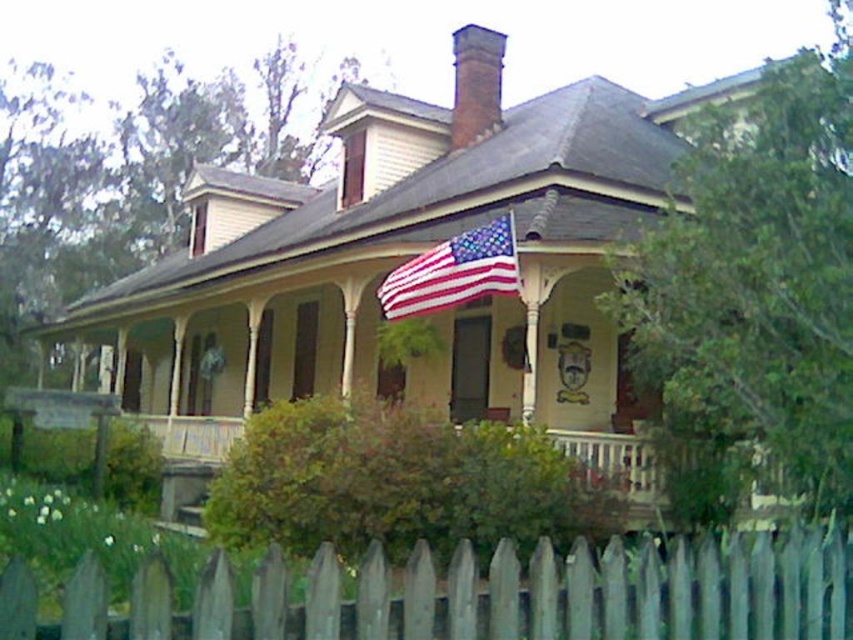
Question: Is gray wooden fence at lower center behind american flag at center?

Choices:
 (A) no
 (B) yes

Answer: (A)

Question: Does gray wooden fence at lower center appear over american flag at center?

Choices:
 (A) yes
 (B) no

Answer: (B)

Question: Which object appears closest to the camera in this image?

Choices:
 (A) american flag at center
 (B) gray wooden fence at lower center

Answer: (B)

Question: Which object is closer to the camera taking this photo?

Choices:
 (A) american flag at center
 (B) gray wooden fence at lower center

Answer: (B)

Question: Does gray wooden fence at lower center have a greater width compared to american flag at center?

Choices:
 (A) no
 (B) yes

Answer: (B)

Question: Which point appears closest to the camera in this image?

Choices:
 (A) (413, 300)
 (B) (283, 608)

Answer: (B)